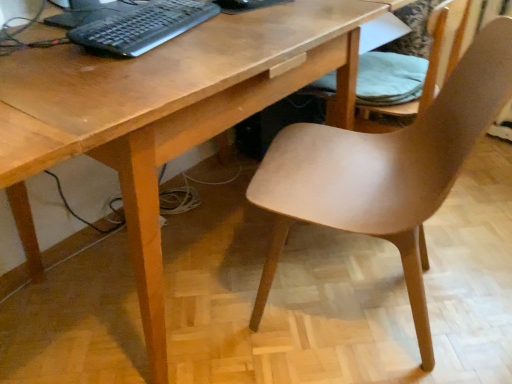
You are a GUI agent. You are given a task and a screenshot of the screen. Output one action in this format:
    pyautogui.click(x=<x>, y=<y>)
    Task: Click on the unoccupied region to the right of black plastic keyboard at upper left
    Image resolution: width=512 pixels, height=384 pixels.
    Given the screenshot: What is the action you would take?
    pyautogui.click(x=251, y=23)